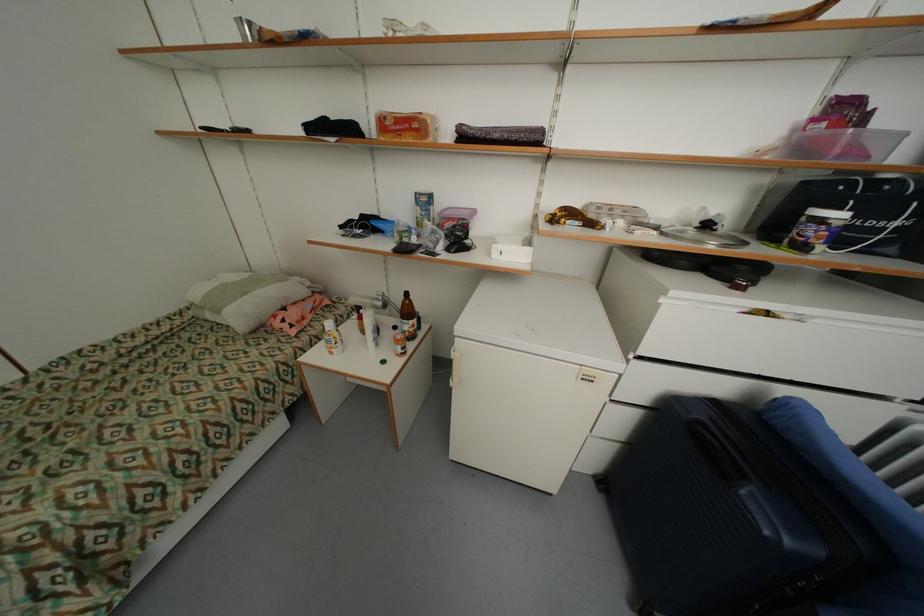
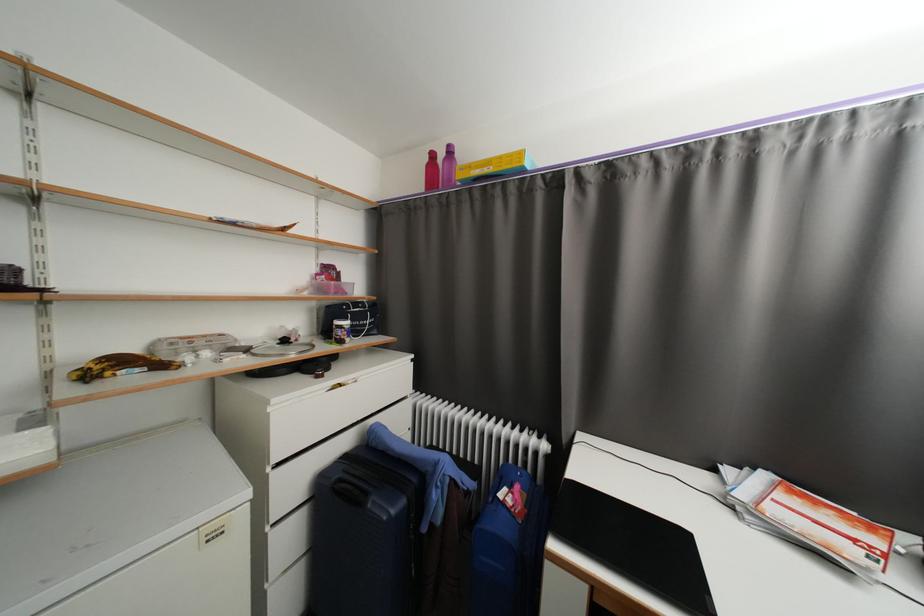
Find the pixel in the second image that matches (709,426) in the first image.

(346, 482)